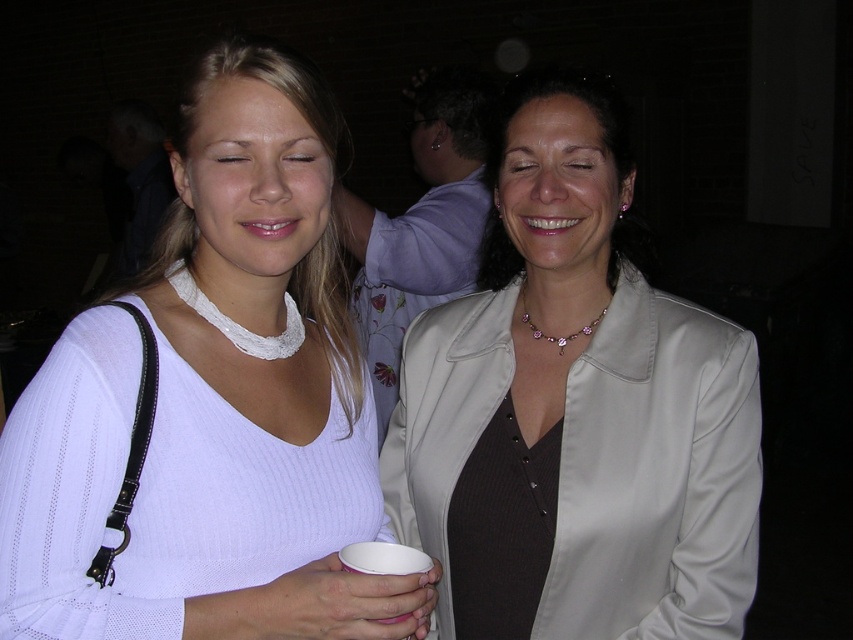
Image resolution: width=853 pixels, height=640 pixels. What do you see at coordinates (213, 404) in the screenshot?
I see `white ribbed sweater at center` at bounding box center [213, 404].

Does white ribbed sweater at center come in front of satin beige blazer at center?

That is True.

Who is more forward, (x=140, y=632) or (x=581, y=193)?

Point (x=140, y=632)

Find the location of `white ribbed sweater at center`. white ribbed sweater at center is located at coordinates (213, 404).